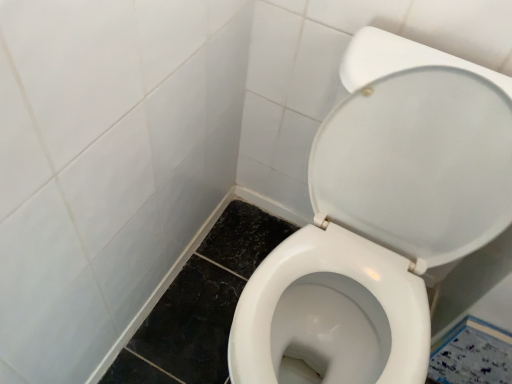
What do you see at coordinates (381, 216) in the screenshot? I see `white glossy toilet at center` at bounding box center [381, 216].

Where is `white glossy toilet at center`? This screenshot has width=512, height=384. white glossy toilet at center is located at coordinates (381, 216).

Identify the location of white glossy tile at lower right. The width and height of the screenshot is (512, 384). (472, 354).

Image resolution: width=512 pixels, height=384 pixels. What do you see at coordinates (472, 354) in the screenshot?
I see `white glossy tile at lower right` at bounding box center [472, 354].

You are a GUI agent. You are given a task and a screenshot of the screen. Output one action in this format:
    pyautogui.click(x=<x>, y=<y>)
    Task: Click on the white glossy toilet at center
    
    Given the screenshot: What is the action you would take?
    [381, 216]

Between white glossy toilet at center and white glossy tile at lower right, which one appears on the left side from the viewer's perspective?

white glossy toilet at center.

Does white glossy toilet at center come behind white glossy tile at lower right?

No, the depth of white glossy toilet at center is less than that of white glossy tile at lower right.

Does point (487, 231) appear closer or farther from the camera than point (488, 379)?

Clearly, point (487, 231) is closer to the camera than point (488, 379).

From the image's perspective, is white glossy toilet at center under white glossy tile at lower right?

No, from the image's perspective, white glossy toilet at center is not below white glossy tile at lower right.

From a real-world perspective, between white glossy toilet at center and white glossy tile at lower right, who is vertically lower?

From a 3D spatial view, white glossy tile at lower right is below.

Considering the sizes of white glossy toilet at center and white glossy tile at lower right in the image, is white glossy toilet at center wider or thinner than white glossy tile at lower right?

white glossy toilet at center is wider than white glossy tile at lower right.

In the scene shown: Who is shorter, white glossy toilet at center or white glossy tile at lower right?

Standing shorter between the two is white glossy tile at lower right.

Looking at the image, does white glossy toilet at center seem bigger or smaller compared to white glossy tile at lower right?

Clearly, white glossy toilet at center is larger in size than white glossy tile at lower right.

Is white glossy toilet at center positioned beyond the bounds of white glossy tile at lower right?

Absolutely, white glossy toilet at center is external to white glossy tile at lower right.

Is white glossy toilet at center far from white glossy tile at lower right?

No, white glossy toilet at center is not far from white glossy tile at lower right.

Is white glossy toilet at center aimed at white glossy tile at lower right?

No, white glossy toilet at center does not turn towards white glossy tile at lower right.

What's the angular difference between white glossy toilet at center and white glossy tile at lower right's facing directions?

The facing directions of white glossy toilet at center and white glossy tile at lower right are 0.351 degrees apart.

Find the location of `square behind the white glossy toilet at center`. square behind the white glossy toilet at center is located at coordinates (472, 354).

In the image, is white glossy tile at lower right on the left side or the right side of white glossy toilet at center?

Clearly, white glossy tile at lower right is on the right of white glossy toilet at center in the image.

Considering the relative positions of white glossy tile at lower right and white glossy toilet at center in the image provided, is white glossy tile at lower right in front of white glossy toilet at center?

No, it is behind white glossy toilet at center.

Does point (493, 367) come in front of point (477, 72)?

No, (493, 367) is behind (477, 72).

From the image's perspective, which one is positioned higher, white glossy tile at lower right or white glossy toilet at center?

white glossy toilet at center, from the image's perspective.

From a real-world perspective, is white glossy tile at lower right located higher than white glossy toilet at center?

Incorrect, from a real-world perspective, white glossy tile at lower right is lower than white glossy toilet at center.

Between white glossy tile at lower right and white glossy toilet at center, which one has larger width?

With larger width is white glossy toilet at center.

Which of these two, white glossy tile at lower right or white glossy toilet at center, stands shorter?

white glossy tile at lower right is shorter.

Between white glossy tile at lower right and white glossy toilet at center, which one has larger size?

With larger size is white glossy toilet at center.

Is white glossy tile at lower right completely or partially outside of white glossy toilet at center?

Yes, white glossy tile at lower right is outside of white glossy toilet at center.

Are white glossy tile at lower right and white glossy toilet at center located far from each other?

That's not correct — white glossy tile at lower right is a little close to white glossy toilet at center.

Does white glossy tile at lower right turn towards white glossy toilet at center?

No, white glossy tile at lower right is not oriented towards white glossy toilet at center.

Locate an element on the screen. The image size is (512, 384). toilet in front of the white glossy tile at lower right is located at coordinates (381, 216).

In the image, there is a white glossy tile at lower right. At what (x,y) coordinates should I click in order to perform the action: click on toilet above it (from the image's perspective). Please return your answer as a coordinate pair (x, y). This screenshot has width=512, height=384. Looking at the image, I should click on (381, 216).

Identify the location of toilet lying on the left of white glossy tile at lower right. (381, 216).